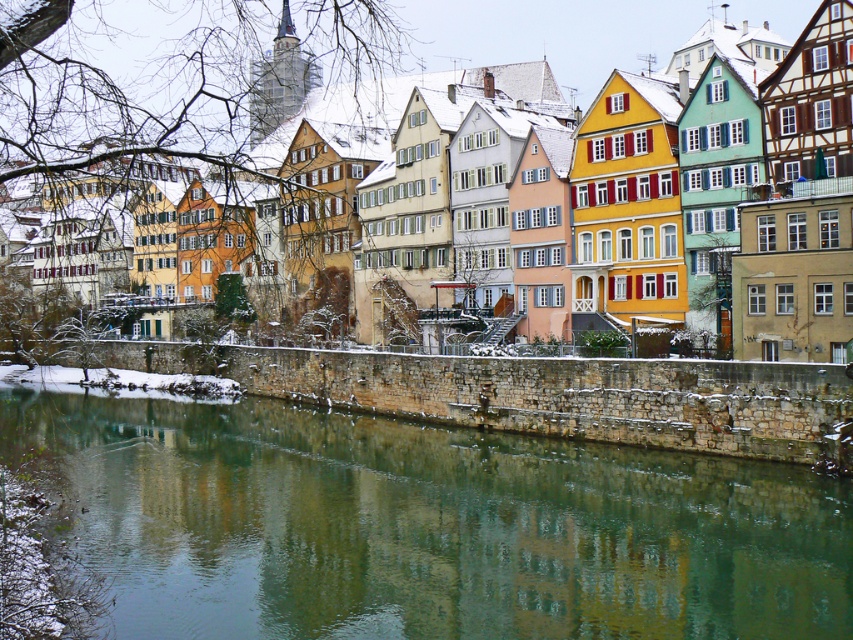
Does point (399, 506) come in front of point (181, 93)?

Yes, it is.

Does green stone wall at lower center have a lesser width compared to wooden half-timbered houses at center?

Yes, green stone wall at lower center is thinner than wooden half-timbered houses at center.

At what (x,y) coordinates should I click in order to perform the action: click on green stone wall at lower center. Please return your answer as a coordinate pair (x, y). Looking at the image, I should click on (428, 528).